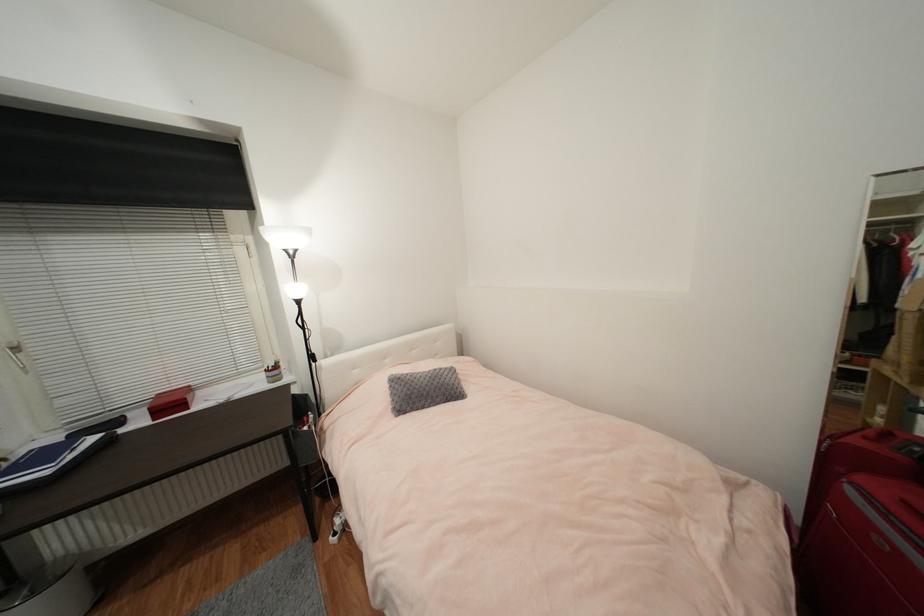
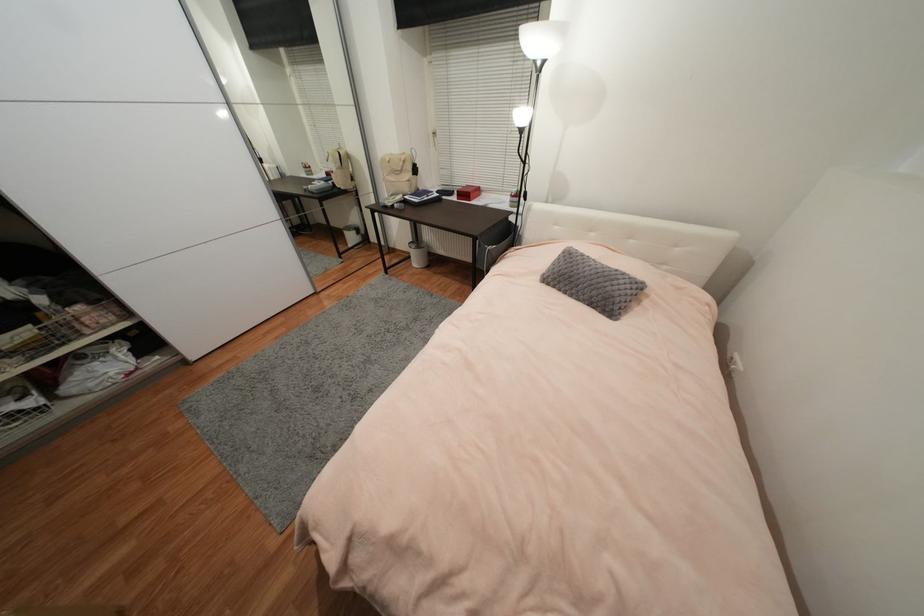
How did the camera likely rotate?

The camera rotated toward left-down.